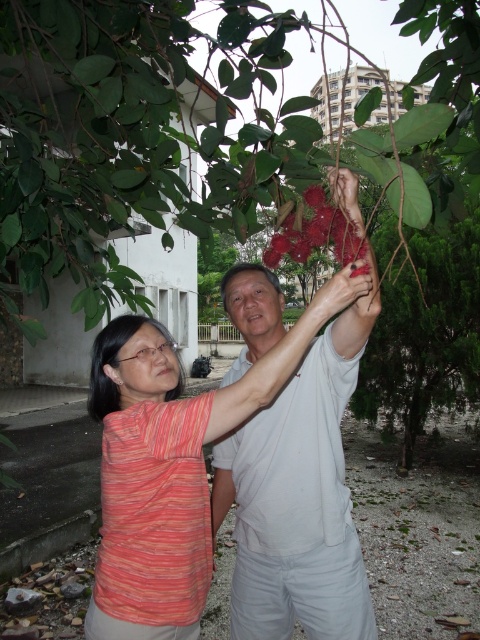
I want to click on glossy red fruit at upper center, so click(x=132, y=134).

At what (x,y) coordinates should I click in order to perform the action: click on glossy red fruit at upper center. Please return your answer as a coordinate pair (x, y). The width and height of the screenshot is (480, 640). Looking at the image, I should click on (132, 134).

Which of these two, glossy red fruit at upper center or striped cotton shirt at center, stands shorter?

striped cotton shirt at center is shorter.

Between point (189, 33) and point (178, 362), which one is positioned behind?

Point (189, 33)

The image size is (480, 640). I want to click on glossy red fruit at upper center, so click(x=132, y=134).

Which is in front, point (175, 582) or point (267, 266)?

Point (175, 582) is more forward.

Can you confirm if striped cotton shirt at center is positioned to the right of glossy red flower at center?

Incorrect, striped cotton shirt at center is not on the right side of glossy red flower at center.

Who is more forward, (192,413) or (339,234)?

Point (192,413)

The width and height of the screenshot is (480, 640). I want to click on striped cotton shirt at center, so click(173, 465).